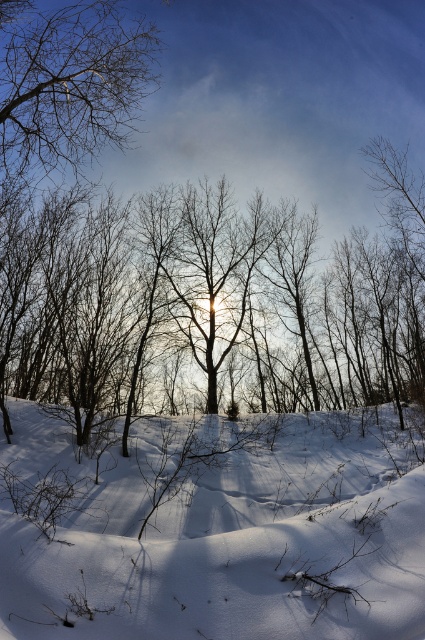
Question: Which of the following is the closest to the observer?

Choices:
 (A) (71, 230)
 (B) (30, 624)
 (C) (25, 4)

Answer: (B)

Question: Can you confirm if white fluffy snow at center is thinner than brown textured branches at upper left?

Choices:
 (A) no
 (B) yes

Answer: (B)

Question: Which point is farther to the camera?

Choices:
 (A) brown bark tree at center
 (B) brown textured branches at upper left
 (C) white fluffy snow at center

Answer: (A)

Question: Can you confirm if brown bark tree at center is smaller than brown textured branches at upper left?

Choices:
 (A) yes
 (B) no

Answer: (B)

Question: Among these points, which one is farthest from the camera?

Choices:
 (A) (36, 77)
 (B) (363, 452)

Answer: (B)

Question: Can you confirm if white fluffy snow at center is positioned below brown bark tree at center?

Choices:
 (A) yes
 (B) no

Answer: (A)